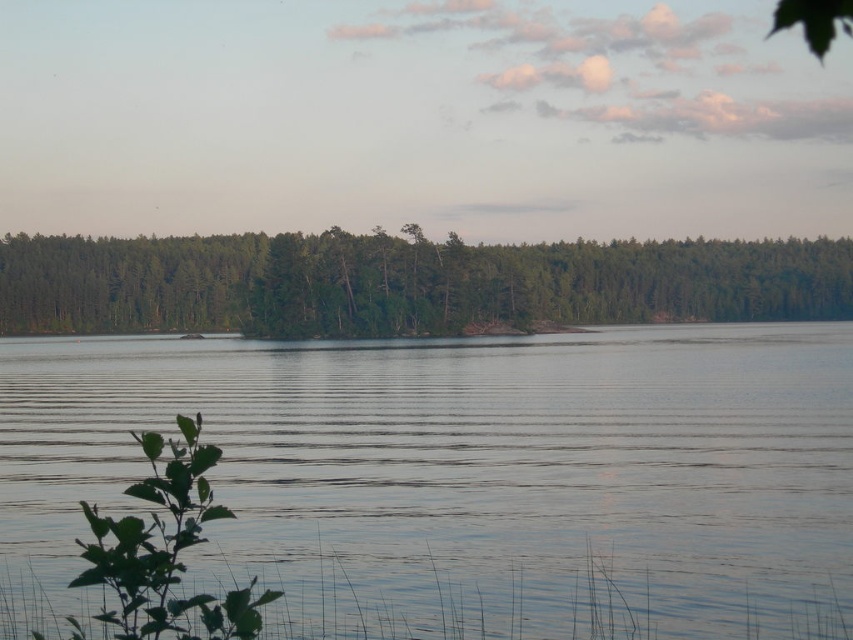
Question: Is clear water at center to the right of green matte forest at center from the viewer's perspective?

Choices:
 (A) yes
 (B) no

Answer: (B)

Question: Is clear water at center further to camera compared to green matte forest at center?

Choices:
 (A) yes
 (B) no

Answer: (B)

Question: Which object is closer to the camera taking this photo?

Choices:
 (A) green matte forest at center
 (B) clear water at center

Answer: (B)

Question: Which point is closer to the camera?

Choices:
 (A) green matte forest at center
 (B) clear water at center

Answer: (B)

Question: Is clear water at center closer to camera compared to green matte forest at center?

Choices:
 (A) yes
 (B) no

Answer: (A)